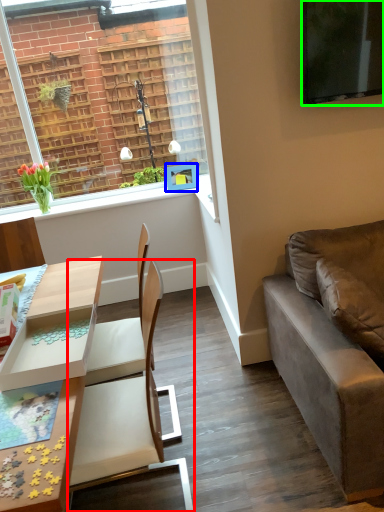
Question: Considering the real-world distances, which object is closest to chair (highlighted by a red box)? picture frame (highlighted by a blue box) or television (highlighted by a green box).

Choices:
 (A) picture frame
 (B) television

Answer: (B)